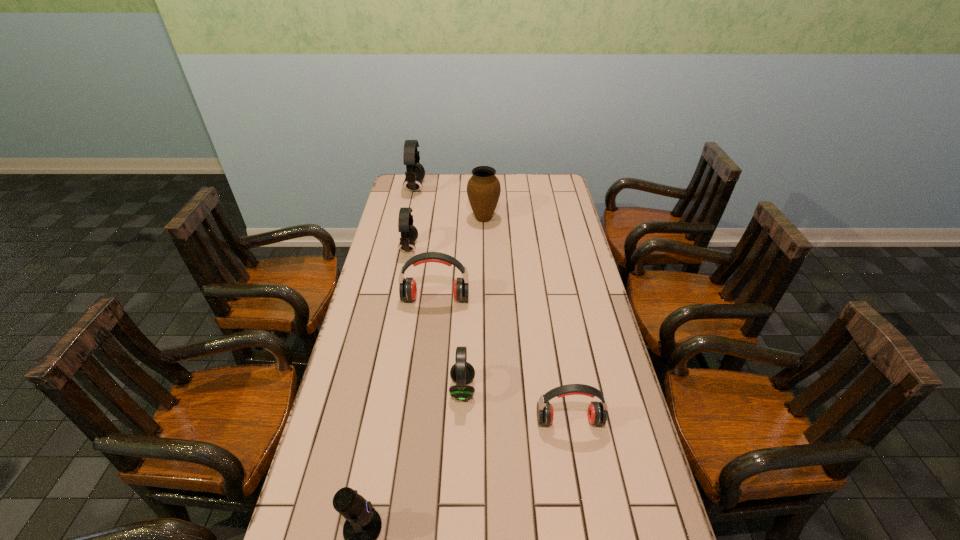
In order to click on the bigger black earphone in this screenshot , I will do `click(415, 172)`.

I want to click on the farthest object, so click(x=415, y=172).

Locate an element on the screen. the second farthest object is located at coordinates (483, 188).

Image resolution: width=960 pixels, height=540 pixels. What are the coordinates of `brown urn` in the screenshot? It's located at (483, 188).

At what (x,y) coordinates should I click in order to perform the action: click on the bigger red earphone. Please return your answer as a coordinate pair (x, y). The width and height of the screenshot is (960, 540). Looking at the image, I should click on (407, 287).

Identify the location of the farther red earphone. (407, 287).

Locate an element on the screen. the fifth nearest object is located at coordinates (409, 233).

The width and height of the screenshot is (960, 540). I want to click on the third nearest earphone, so click(x=409, y=233).

The width and height of the screenshot is (960, 540). I want to click on the third nearest object, so click(x=462, y=372).

This screenshot has width=960, height=540. I want to click on headset, so click(x=462, y=372).